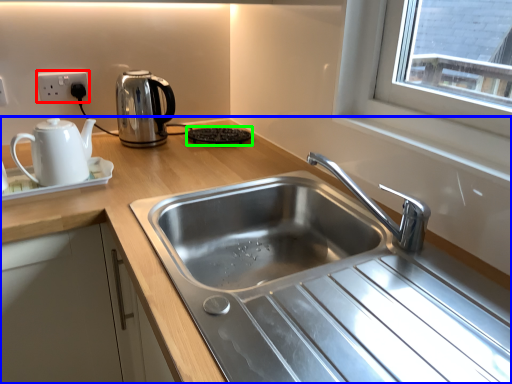
Question: Estimate the real-world distances between objects in this image. Which object is farther from electric outlet (highlighted by a red box), countertop (highlighted by a blue box) or appliance (highlighted by a green box)?

Choices:
 (A) countertop
 (B) appliance

Answer: (A)